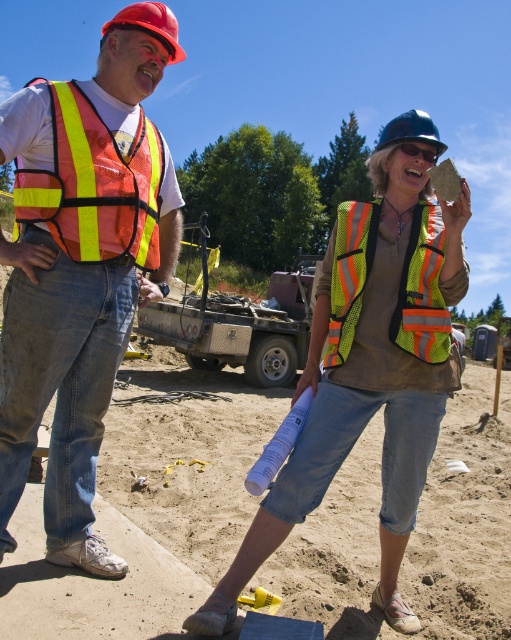
Question: Which point is closer to the camera?

Choices:
 (A) hard hat at center
 (B) neon reflective safety vest at center
 (C) reflective mesh safety vest at left

Answer: (C)

Question: Can you confirm if reflective safety vest at center is positioned below reflective mesh safety vest at left?

Choices:
 (A) yes
 (B) no

Answer: (A)

Question: Considering the real-world distances, which object is closest to the reflective orange safety vest at left?

Choices:
 (A) transparent plastic goggles at center
 (B) hard hat at center

Answer: (A)

Question: Can you confirm if reflective orange safety vest at left is wider than red hard hat at upper left?

Choices:
 (A) no
 (B) yes

Answer: (A)

Question: Does reflective orange safety vest at left have a larger size compared to hard hat at center?

Choices:
 (A) no
 (B) yes

Answer: (A)

Question: Which of the following is the farthest from the observer?

Choices:
 (A) hard hat at center
 (B) reflective orange safety vest at left
 (C) reflective mesh safety vest at left

Answer: (A)